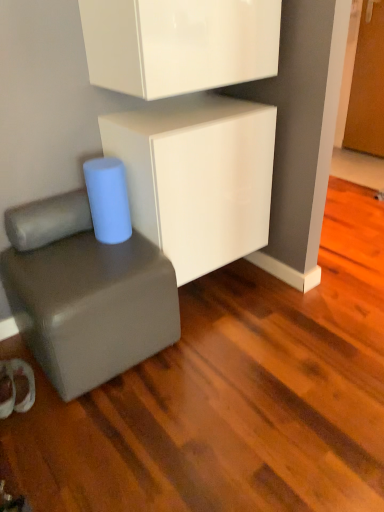
Question: Can you confirm if matte gray cube at lower left is bigger than white glossy cabinet at center, which appears as the 2th cabinetry when viewed from the top?

Choices:
 (A) no
 (B) yes

Answer: (A)

Question: Considering the relative sizes of matte gray cube at lower left and white glossy cabinet at center, marked as the first cabinetry in a bottom-to-top arrangement, in the image provided, is matte gray cube at lower left thinner than white glossy cabinet at center, marked as the first cabinetry in a bottom-to-top arrangement,?

Choices:
 (A) yes
 (B) no

Answer: (B)

Question: Does matte gray cube at lower left contain white glossy cabinet at center, which appears as the 2th cabinetry when viewed from the top?

Choices:
 (A) yes
 (B) no

Answer: (B)

Question: Can you confirm if matte gray cube at lower left is positioned to the right of white glossy cabinet at center, which appears as the 2th cabinetry when viewed from the top?

Choices:
 (A) no
 (B) yes

Answer: (A)

Question: Is there a large distance between matte gray cube at lower left and white glossy cabinet at center, which appears as the 2th cabinetry when viewed from the top?

Choices:
 (A) no
 (B) yes

Answer: (A)

Question: Based on their positions, is white glossy cabinet at center, which appears as the 2th cabinetry when viewed from the top, located to the left or right of glossy white cabinet at upper center, the first cabinetry viewed from the top?

Choices:
 (A) left
 (B) right

Answer: (B)

Question: Is point (238, 252) positioned closer to the camera than point (137, 46)?

Choices:
 (A) closer
 (B) farther

Answer: (B)

Question: From a real-world perspective, is white glossy cabinet at center, marked as the first cabinetry in a bottom-to-top arrangement, physically located above or below glossy white cabinet at upper center, which is counted as the 2th cabinetry, starting from the bottom?

Choices:
 (A) below
 (B) above

Answer: (A)

Question: From the image's perspective, is white glossy cabinet at center, which appears as the 2th cabinetry when viewed from the top, located above or below glossy white cabinet at upper center, the first cabinetry viewed from the top?

Choices:
 (A) above
 (B) below

Answer: (B)

Question: Considering their positions, is glossy white cabinet at upper center, the first cabinetry viewed from the top, located in front of or behind matte gray cube at lower left?

Choices:
 (A) front
 (B) behind

Answer: (A)

Question: From the image's perspective, is glossy white cabinet at upper center, the first cabinetry viewed from the top, located above or below matte gray cube at lower left?

Choices:
 (A) below
 (B) above

Answer: (B)

Question: In terms of height, does glossy white cabinet at upper center, which is counted as the 2th cabinetry, starting from the bottom, look taller or shorter compared to matte gray cube at lower left?

Choices:
 (A) tall
 (B) short

Answer: (B)

Question: Which is correct: glossy white cabinet at upper center, the first cabinetry viewed from the top, is inside matte gray cube at lower left, or outside of it?

Choices:
 (A) inside
 (B) outside

Answer: (B)

Question: From a real-world perspective, relative to white glossy cabinet at center, which appears as the 2th cabinetry when viewed from the top, is matte gray cube at lower left vertically above or below?

Choices:
 (A) below
 (B) above

Answer: (A)

Question: Is point click(110, 309) closer or farther from the camera than point click(274, 115)?

Choices:
 (A) closer
 (B) farther

Answer: (A)